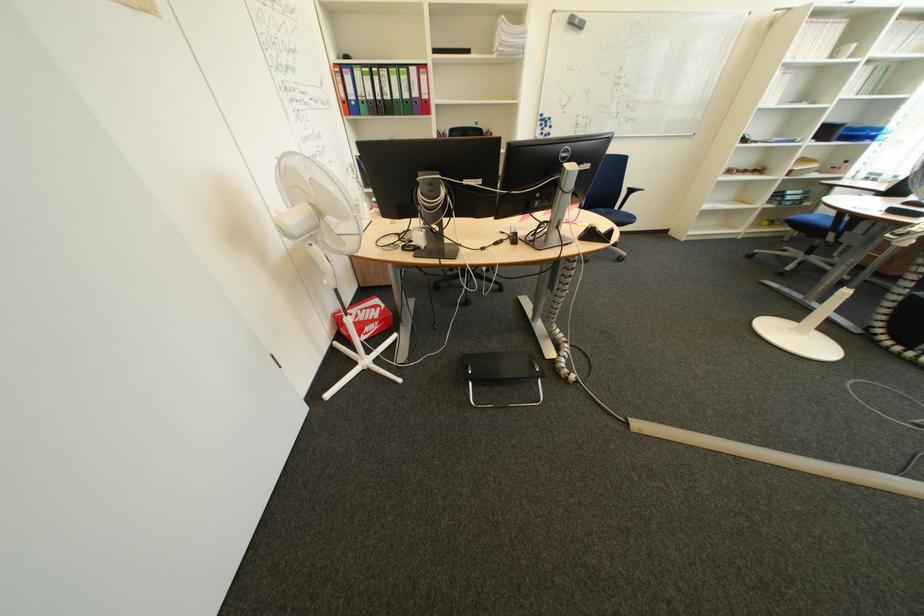
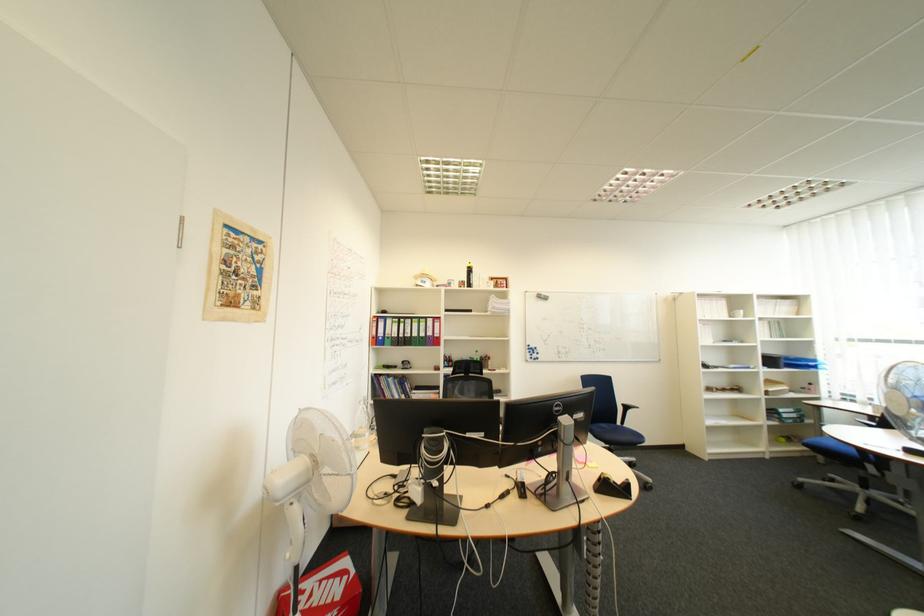
Question: The images are taken continuously from a first-person perspective. In which direction is your viewpoint rotating?

Choices:
 (A) Left
 (B) Right
 (C) Up
 (D) Down

Answer: (C)